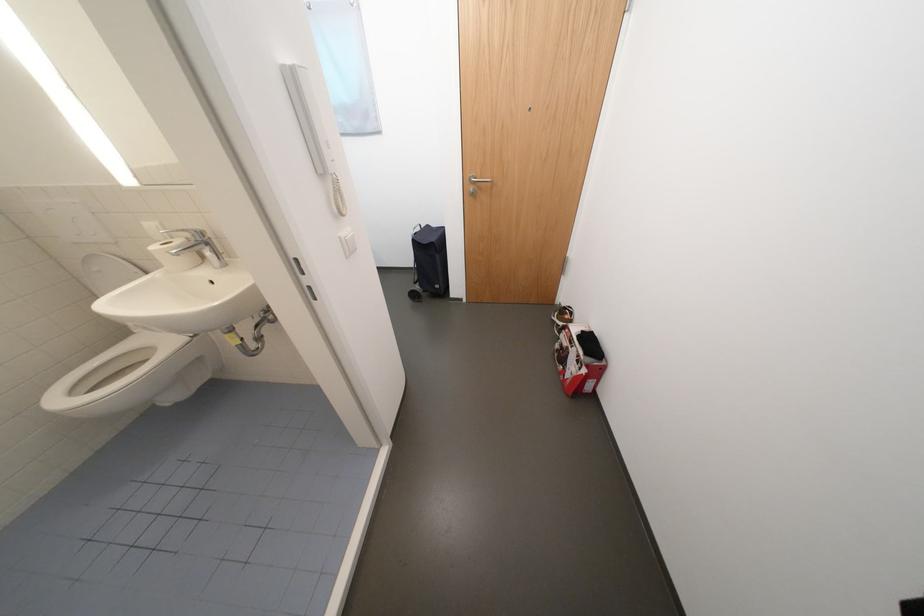
Image resolution: width=924 pixels, height=616 pixels. Describe the element at coordinates (123, 376) in the screenshot. I see `the white toilet seat` at that location.